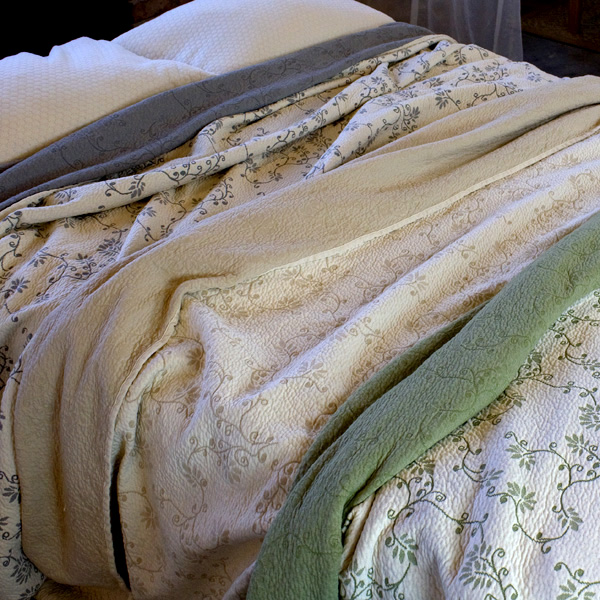
Locate an element on the screen. pillow is located at coordinates (59, 92), (266, 35).